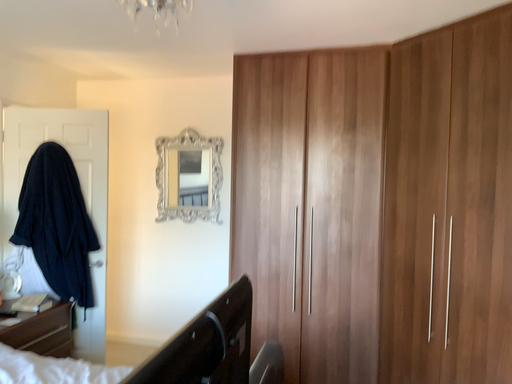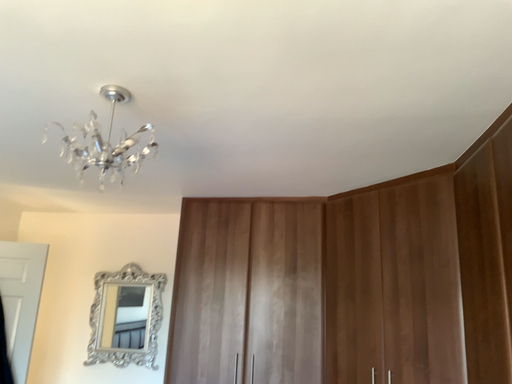
Question: Which way did the camera rotate in the video?

Choices:
 (A) rotated left
 (B) rotated right

Answer: (B)